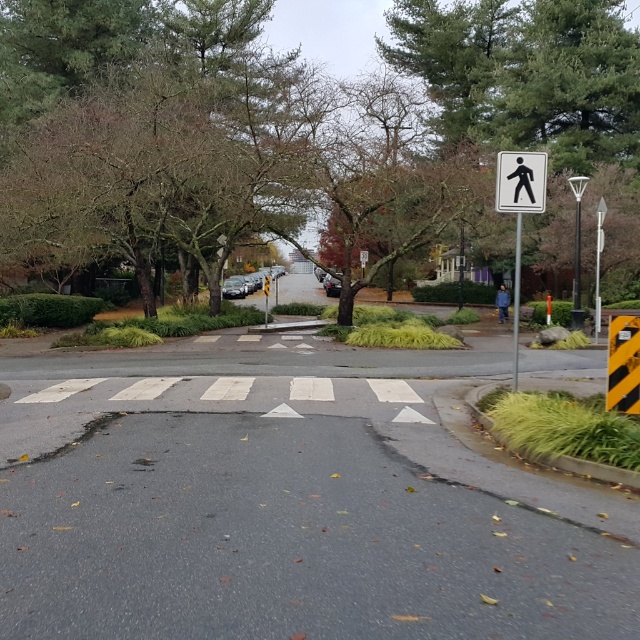
Can you confirm if green leafy tree at upper center is wider than black plastic pedestrian sign at upper right?

Yes, green leafy tree at upper center is wider than black plastic pedestrian sign at upper right.

Find the location of `green leafy tree at upper center`. green leafy tree at upper center is located at coordinates (68, 45).

Does black/yellow striped sign at right have a smaller size compared to black plastic pedestrian sign at upper right?

Indeed, black/yellow striped sign at right has a smaller size compared to black plastic pedestrian sign at upper right.

Between black/yellow striped sign at right and black plastic pedestrian sign at upper right, which one appears on the left side from the viewer's perspective?

From the viewer's perspective, black plastic pedestrian sign at upper right appears more on the left side.

Is point (611, 372) closer to camera compared to point (502, 161)?

Yes, it is in front of point (502, 161).

The image size is (640, 640). Find the location of `black/yellow striped sign at right`. black/yellow striped sign at right is located at coordinates (624, 364).

Does black plastic pedestrian sign at upper right have a lesser width compared to white plastic pedestrian sign at upper right?

Yes, black plastic pedestrian sign at upper right is thinner than white plastic pedestrian sign at upper right.

Can you confirm if black plastic pedestrian sign at upper right is positioned above white plastic pedestrian sign at upper right?

Incorrect, black plastic pedestrian sign at upper right is not positioned above white plastic pedestrian sign at upper right.

Between point (532, 189) and point (576, 198), which one is positioned behind?

The point (576, 198) is behind.

Find the location of `black plastic pedestrian sign at upper right`. black plastic pedestrian sign at upper right is located at coordinates pos(520,180).